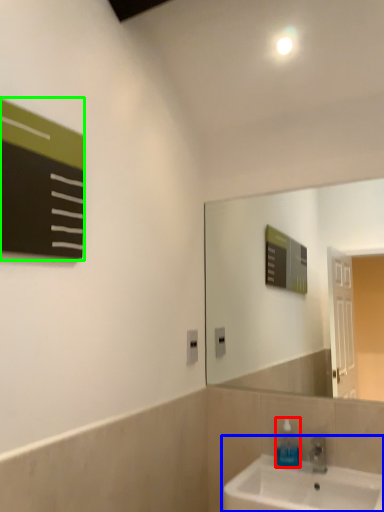
Question: Based on their relative distances, which object is farther from soap dispenser (highlighted by a red box)? Choose from sink (highlighted by a blue box) and bulletin board (highlighted by a green box).

Choices:
 (A) sink
 (B) bulletin board

Answer: (B)